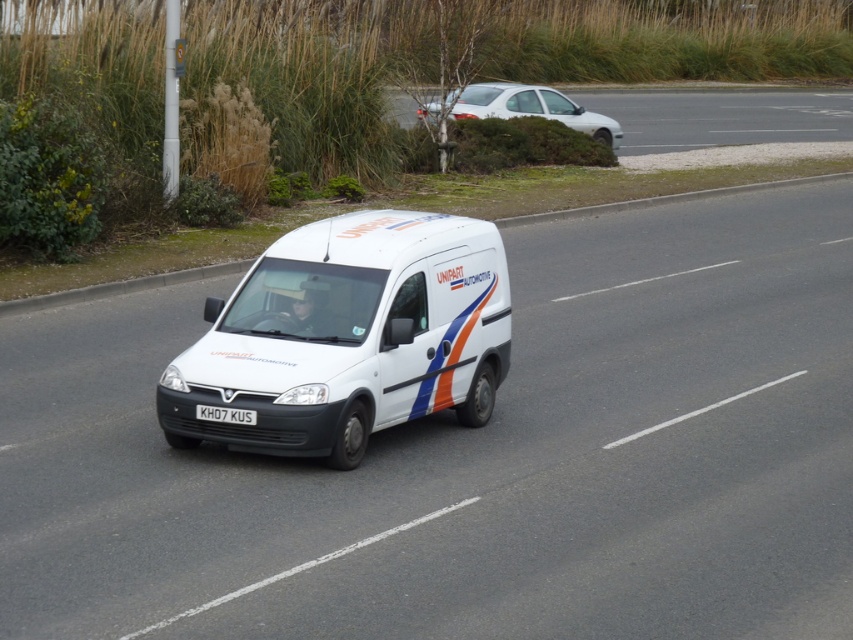
Is point (849, 122) in front of point (518, 106)?

No, (849, 122) is behind (518, 106).

Does white glossy car at upper center lie in front of white matte car at upper center?

Yes, it is in front of white matte car at upper center.

Locate an element on the screen. This screenshot has height=640, width=853. white glossy car at upper center is located at coordinates (720, 116).

From the picture: Can you confirm if white matte van at center is positioned to the left of white matte car at upper center?

Yes, white matte van at center is to the left of white matte car at upper center.

Is white matte van at center wider than white matte car at upper center?

Incorrect, white matte van at center's width does not surpass white matte car at upper center's.

Does point (386, 404) lie behind point (531, 112)?

No, (386, 404) is in front of (531, 112).

At what (x,y) coordinates should I click in order to perform the action: click on white matte van at center. Please return your answer as a coordinate pair (x, y). This screenshot has width=853, height=640. Looking at the image, I should click on (349, 337).

Which of these two, white glossy car at upper center or white plastic license plate at center, stands taller?

white glossy car at upper center

Find the location of `white glossy car at upper center`. white glossy car at upper center is located at coordinates (720, 116).

This screenshot has height=640, width=853. In order to click on white glossy car at upper center in this screenshot , I will do `click(720, 116)`.